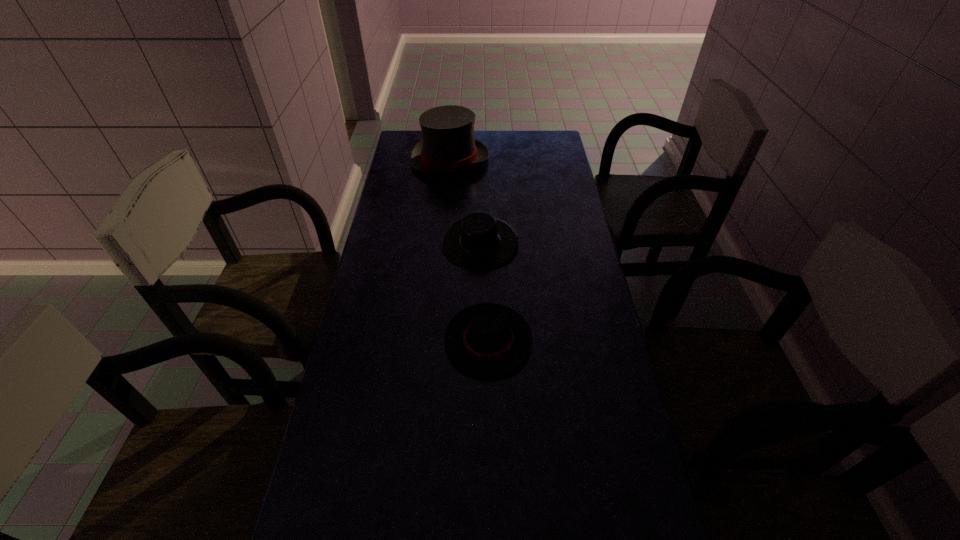
At what (x,y) coordinates should I click in order to perform the action: click on the third closest object to the second farthest dress hat. Please return your answer as a coordinate pair (x, y). The image size is (960, 540). Looking at the image, I should click on (380, 509).

Identify which object is the third closest to the nearest object. Please provide its 2D coordinates. Your answer should be formatted as a tuple, i.e. [(x, y)], where the tuple contains the x and y coordinates of a point satisfying the conditions above.

[(448, 145)]

Find the location of `the closest dress hat relative to the nearest object`. the closest dress hat relative to the nearest object is located at coordinates (488, 339).

I want to click on the second closest dress hat to the shortest object, so click(x=479, y=242).

Locate an element on the screen. Image resolution: width=960 pixels, height=540 pixels. free space that satisfies the following two spatial constraints: 1. on the front side of the third tallest object; 2. on the right side of the tallest object is located at coordinates (435, 341).

Image resolution: width=960 pixels, height=540 pixels. Find the location of `vacant space that satisfies the following two spatial constraints: 1. on the front side of the tallest object; 2. on the right side of the shortest dress hat`. vacant space that satisfies the following two spatial constraints: 1. on the front side of the tallest object; 2. on the right side of the shortest dress hat is located at coordinates (435, 341).